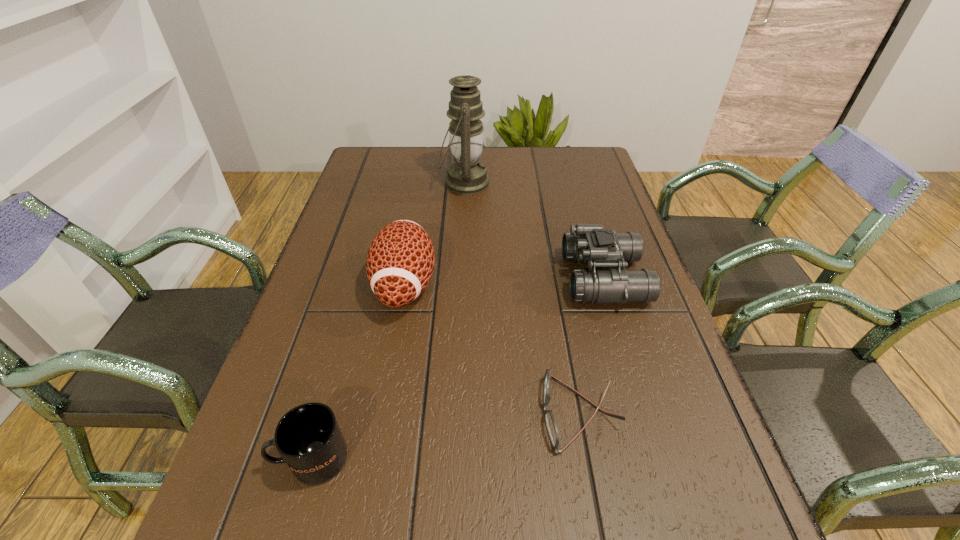
At what (x,y) coordinates should I click in order to perform the action: click on object that is the third nearest to the football. Please return your answer as a coordinate pair (x, y). The height and width of the screenshot is (540, 960). Looking at the image, I should click on (552, 429).

You are a GUI agent. You are given a task and a screenshot of the screen. Output one action in this format:
    pyautogui.click(x=<x>, y=<y>)
    Task: Click on the free spot that satisfies the following two spatial constraints: 1. through the lenses of the binoculars; 2. on the front side of the football
    
    Given the screenshot: What is the action you would take?
    pyautogui.click(x=606, y=285)